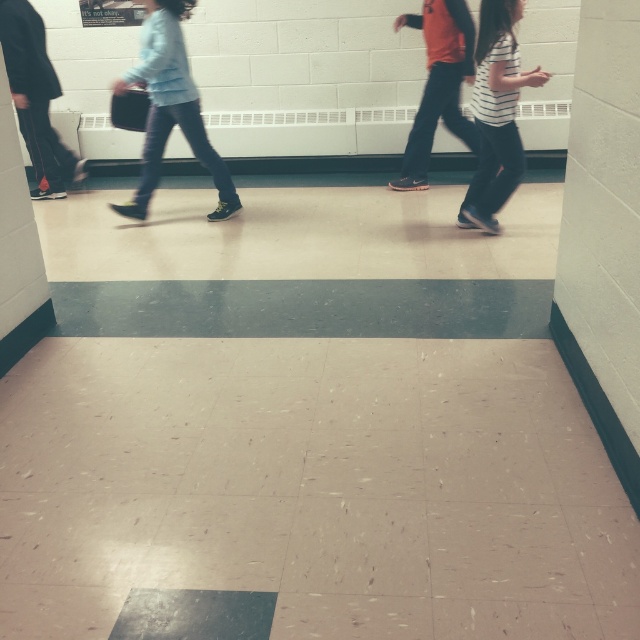
Is light blue denim jacket at upper left to the right of orange fabric shirt at center from the viewer's perspective?

Incorrect, light blue denim jacket at upper left is not on the right side of orange fabric shirt at center.

Does light blue denim jacket at upper left have a larger size compared to orange fabric shirt at center?

Correct, light blue denim jacket at upper left is larger in size than orange fabric shirt at center.

Which is behind, point (179, 65) or point (464, 51)?

The point (464, 51) is behind.

At what (x,y) coordinates should I click in order to perform the action: click on light blue denim jacket at upper left. Please return your answer as a coordinate pair (x, y). Looking at the image, I should click on (170, 106).

Does point (500, 92) come in front of point (435, 100)?

Yes.

Can you confirm if white striped shirt at center is shorter than orange fabric shirt at center?

No.

Is point (486, 17) positioned in front of point (429, 136)?

Yes, point (486, 17) is in front of point (429, 136).

Identify the location of white striped shirt at center. The height and width of the screenshot is (640, 640). (497, 113).

Between point (172, 125) and point (477, 67), which one is positioned in front?

Point (477, 67)

Is light blue denim jacket at upper left shorter than white striped shirt at center?

No.

Find the location of a particular element. The height and width of the screenshot is (640, 640). light blue denim jacket at upper left is located at coordinates (170, 106).